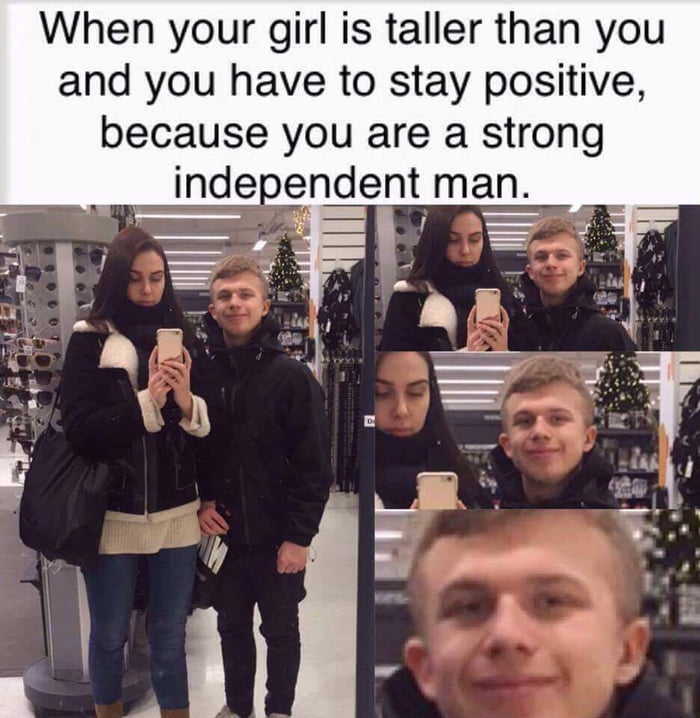
This screenshot has width=700, height=718. What are the coordinates of `christmas tree` in the screenshot? It's located at (294, 273), (600, 235), (620, 365), (671, 540).